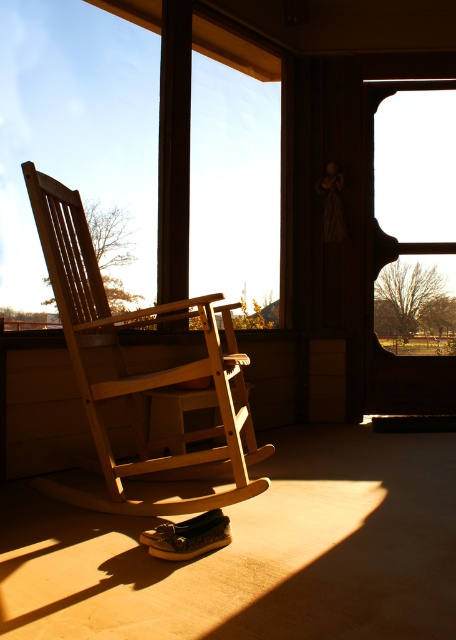
Question: Is transparent glass window at upper center to the right of light brown wood rocking chair at center from the viewer's perspective?

Choices:
 (A) no
 (B) yes

Answer: (A)

Question: Considering the relative positions of transparent glass window at upper center and light brown wood rocking chair at center in the image provided, where is transparent glass window at upper center located with respect to light brown wood rocking chair at center?

Choices:
 (A) left
 (B) right

Answer: (A)

Question: Considering the real-world distances, which object is farthest from the light brown wood rocking chair at center?

Choices:
 (A) transparent glass window at upper center
 (B) transparent glass window at center

Answer: (A)

Question: Considering the real-world distances, which object is closest to the light brown wood rocking chair at center?

Choices:
 (A) transparent glass window at upper center
 (B) transparent glass window at center

Answer: (B)

Question: Estimate the real-world distances between objects in this image. Which object is closer to the transparent glass window at upper center?

Choices:
 (A) light brown wood rocking chair at center
 (B) transparent glass window at center

Answer: (B)

Question: Is light brown wood rocking chair at center wider than transparent glass window at center?

Choices:
 (A) no
 (B) yes

Answer: (B)